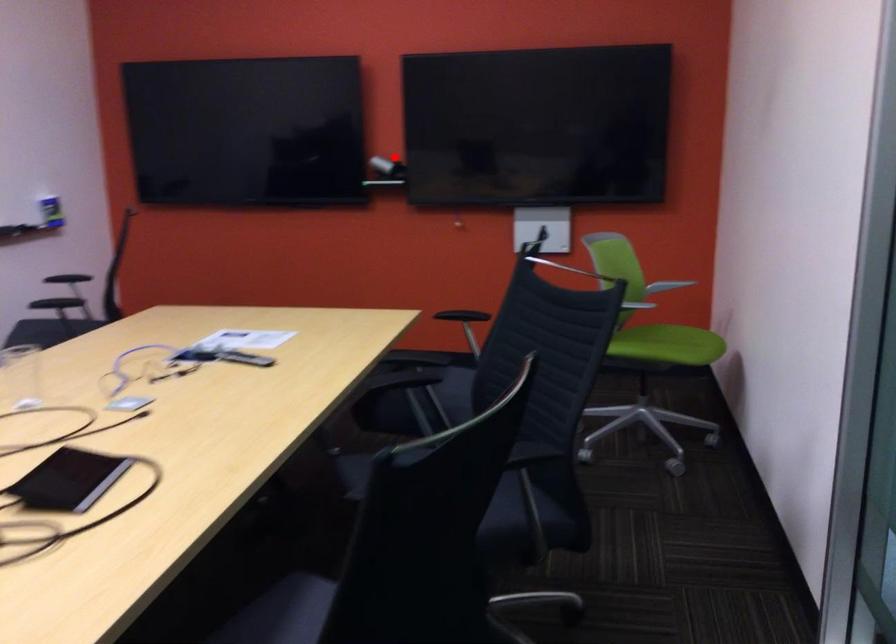
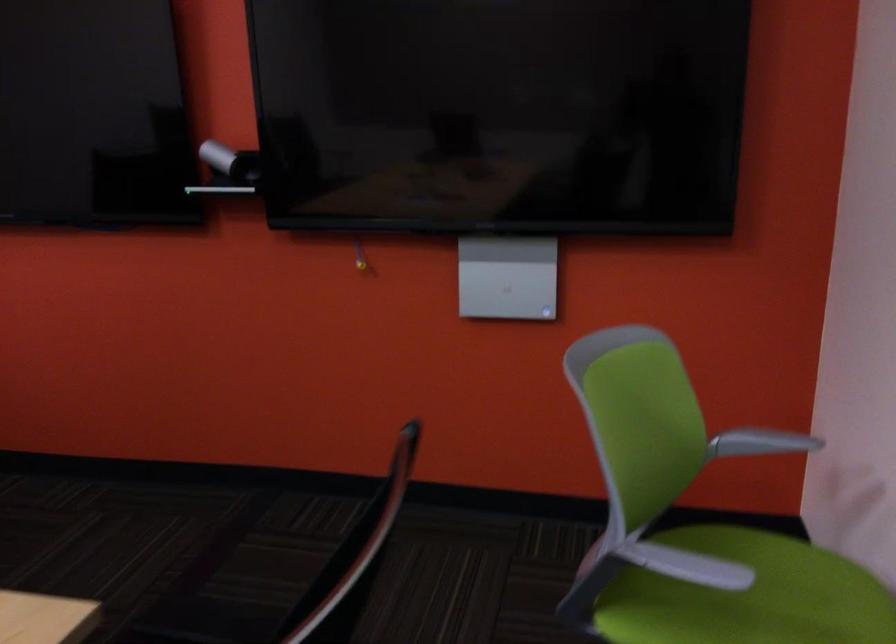
In the second image, find the point that corresponds to the highlighted location in the first image.

(230, 162)